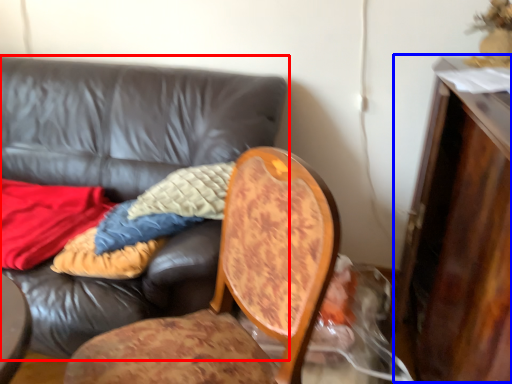
Question: Which of the following is the farthest to the observer, studio couch (highlighted by a red box) or dresser (highlighted by a blue box)?

Choices:
 (A) studio couch
 (B) dresser

Answer: (A)